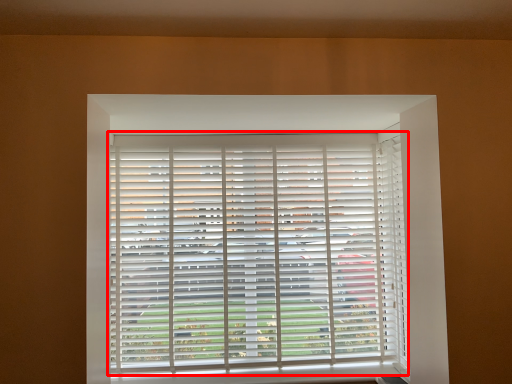
Question: From the image's perspective, where is window blind (annotated by the red box) located relative to curtain?

Choices:
 (A) below
 (B) above

Answer: (A)